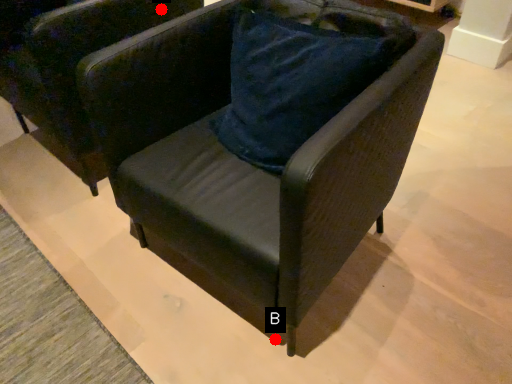
Question: Two points are circled on the image, labeled by A and B beside each circle. Among these points, which one is farthest from the camera?

Choices:
 (A) A is further
 (B) B is further

Answer: (A)